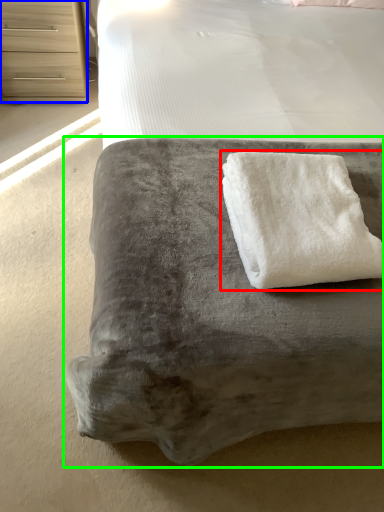
Question: Considering the real-world distances, which object is farthest from towel (highlighted by a red box)? chest of drawers (highlighted by a blue box) or furniture (highlighted by a green box)?

Choices:
 (A) chest of drawers
 (B) furniture

Answer: (A)